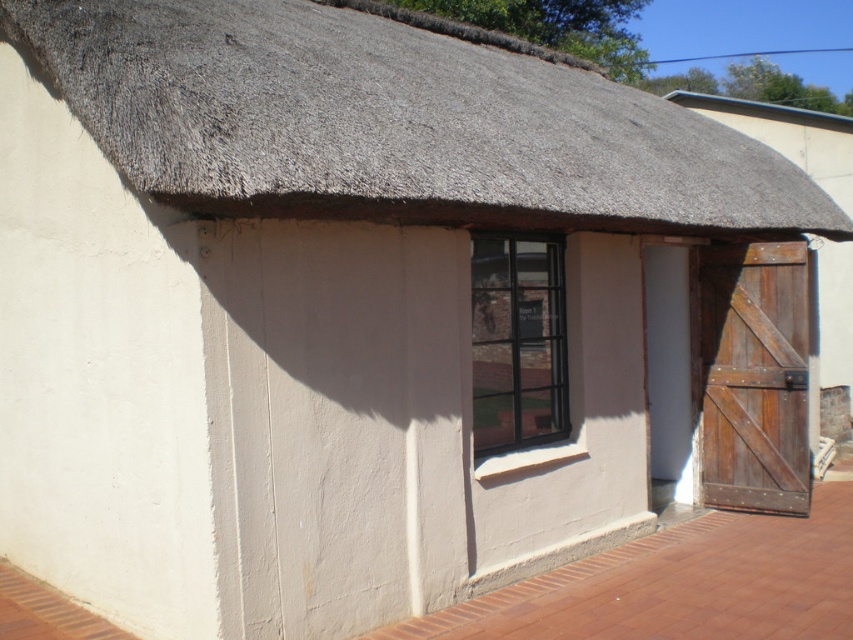
Who is more distant from viewer, (x=102, y=67) or (x=512, y=390)?

The point (x=512, y=390) is more distant.

Locate an element on the screen. thatched straw roof at upper center is located at coordinates (392, 120).

Find the location of a particular element. This screenshot has width=853, height=640. thatched straw roof at upper center is located at coordinates (392, 120).

Which is more to the left, thatched straw roof at upper center or rustic wooden door at right?

From the viewer's perspective, thatched straw roof at upper center appears more on the left side.

Is thatched straw roof at upper center smaller than rustic wooden door at right?

Correct, thatched straw roof at upper center occupies less space than rustic wooden door at right.

Find the location of a particular element. The width and height of the screenshot is (853, 640). thatched straw roof at upper center is located at coordinates (392, 120).

Can you confirm if rustic wooden door at right is thinner than black metal window at center?

Incorrect, rustic wooden door at right's width is not less than black metal window at center's.

Which is below, rustic wooden door at right or black metal window at center?

Positioned lower is rustic wooden door at right.

Is point (747, 444) more distant than point (471, 312)?

Yes.

I want to click on rustic wooden door at right, so click(753, 378).